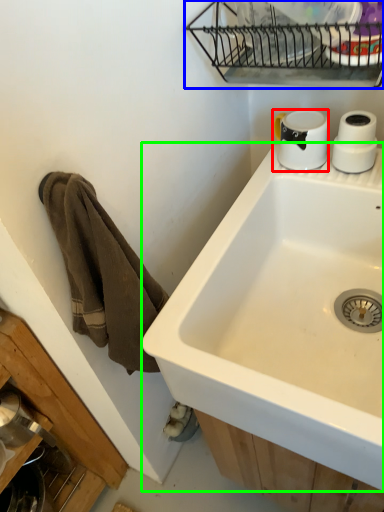
Question: Which is farther away from coffee cup (highlighted by a red box)? appliance (highlighted by a blue box) or sink (highlighted by a green box)?

Choices:
 (A) appliance
 (B) sink

Answer: (B)